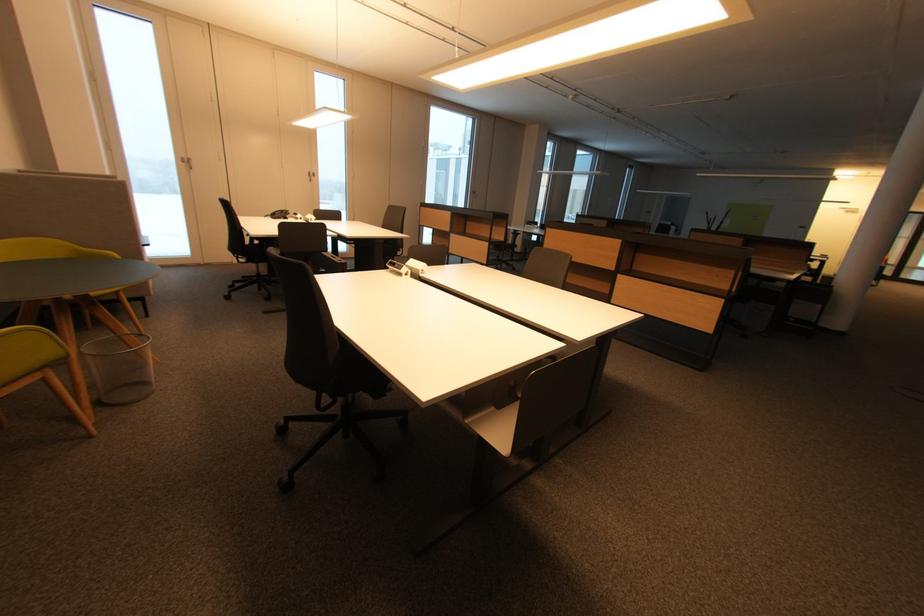
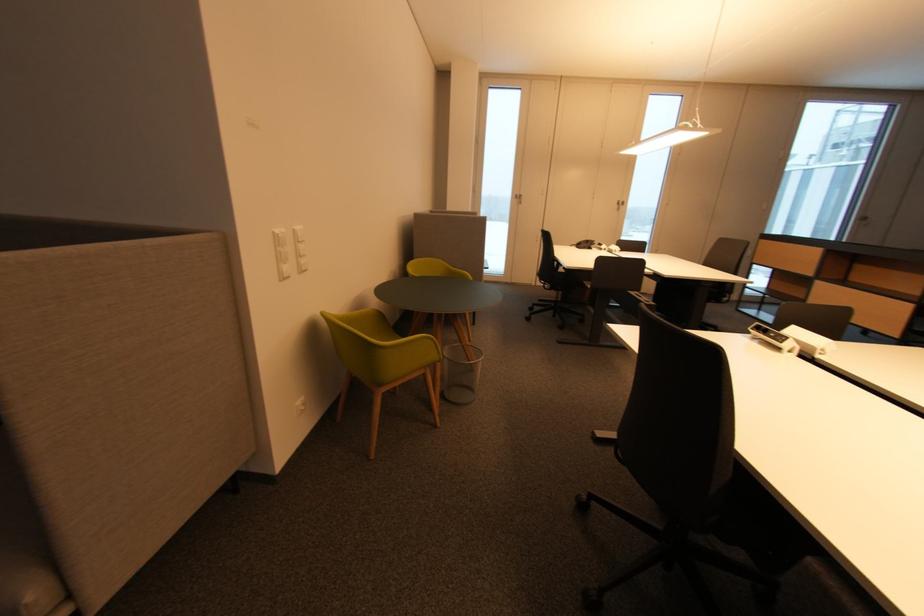
Question: How did the camera likely rotate?

Choices:
 (A) Left
 (B) Right
 (C) Up
 (D) Down

Answer: (A)